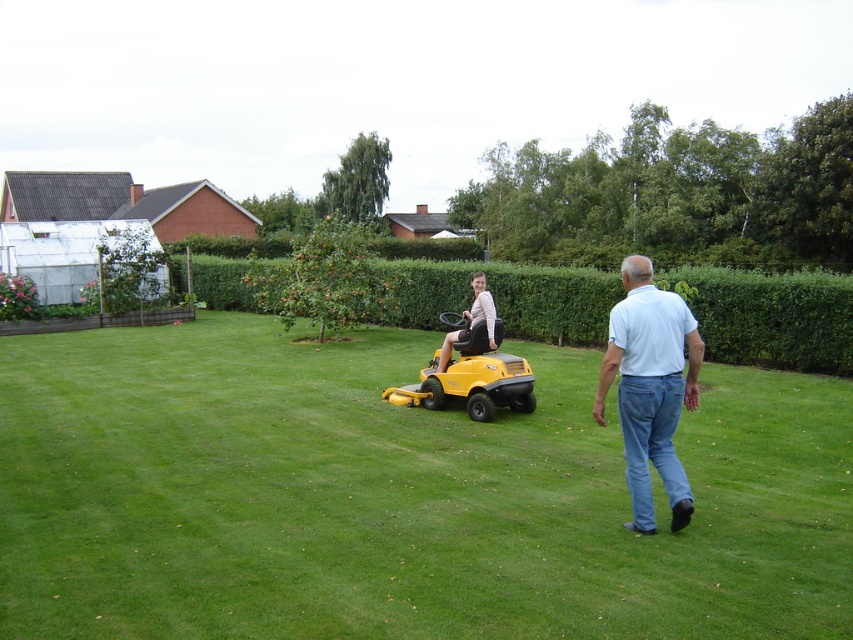
Question: Considering the relative positions of white cotton shirt at center and yellow plastic lawn mower at center in the image provided, where is white cotton shirt at center located with respect to yellow plastic lawn mower at center?

Choices:
 (A) right
 (B) left

Answer: (A)

Question: Where is green grass at center located in relation to yellow plastic lawn mower at center in the image?

Choices:
 (A) below
 (B) above

Answer: (A)

Question: Is green grass at center thinner than light beige fabric lawn mower at center?

Choices:
 (A) no
 (B) yes

Answer: (A)

Question: Among these objects, which one is farthest from the camera?

Choices:
 (A) white cotton shirt at center
 (B) green hedge at center
 (C) green grass at center

Answer: (B)

Question: Which point is farther to the camera?

Choices:
 (A) (665, 444)
 (B) (469, 310)
 (C) (117, 506)

Answer: (B)

Question: Based on their relative distances, which object is farther from the yellow plastic lawn mower at center?

Choices:
 (A) white cotton shirt at center
 (B) green grass at center
 (C) green hedge at center

Answer: (C)